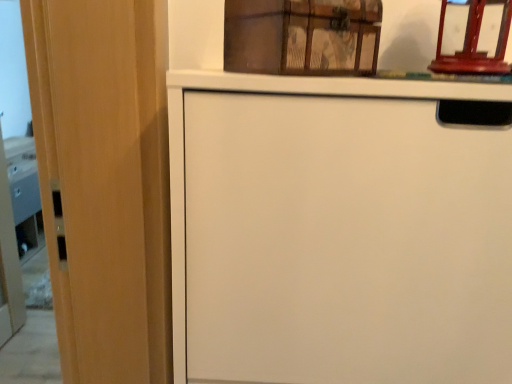
Question: Choose the correct answer: Is wooden trunk at upper center, which is counted as the second cabinetry, starting from the bottom, inside white matte cabinet at center, the first cabinetry when ordered from bottom to top, or outside it?

Choices:
 (A) outside
 (B) inside

Answer: (A)

Question: Is wooden trunk at upper center, placed as the first cabinetry when sorted from top to bottom, to the left or to the right of white matte cabinet at center, the second cabinetry in the top-to-bottom sequence, in the image?

Choices:
 (A) left
 (B) right

Answer: (A)

Question: Based on their sizes in the image, would you say wooden trunk at upper center, which is counted as the second cabinetry, starting from the bottom, is bigger or smaller than white matte cabinet at center, the second cabinetry in the top-to-bottom sequence?

Choices:
 (A) big
 (B) small

Answer: (B)

Question: Is point click(x=186, y=316) closer or farther from the camera than point click(x=254, y=26)?

Choices:
 (A) farther
 (B) closer

Answer: (A)

Question: In terms of height, does white matte cabinet at center, the first cabinetry when ordered from bottom to top, look taller or shorter compared to wooden trunk at upper center, placed as the first cabinetry when sorted from top to bottom?

Choices:
 (A) tall
 (B) short

Answer: (A)

Question: From a real-world perspective, relative to wooden trunk at upper center, placed as the first cabinetry when sorted from top to bottom, is white matte cabinet at center, the first cabinetry when ordered from bottom to top, vertically above or below?

Choices:
 (A) above
 (B) below

Answer: (B)

Question: Considering their positions, is white matte cabinet at center, the first cabinetry when ordered from bottom to top, located in front of or behind wooden trunk at upper center, placed as the first cabinetry when sorted from top to bottom?

Choices:
 (A) behind
 (B) front

Answer: (B)